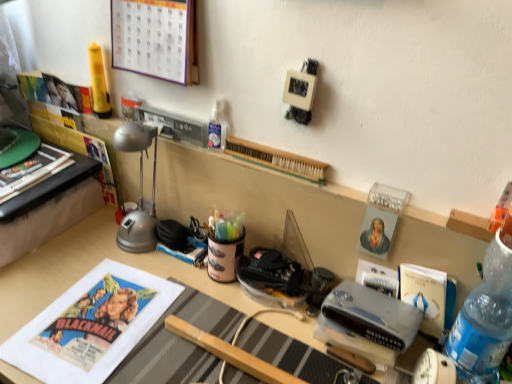
Question: Can you confirm if white paper poster at center is positioned to the left of matte paper calendar at upper left?

Choices:
 (A) no
 (B) yes

Answer: (B)

Question: Is white paper poster at center positioned behind matte paper calendar at upper left?

Choices:
 (A) yes
 (B) no

Answer: (B)

Question: Can you confirm if white paper poster at center is shorter than matte paper calendar at upper left?

Choices:
 (A) no
 (B) yes

Answer: (B)

Question: Is white paper poster at center looking in the opposite direction of matte paper calendar at upper left?

Choices:
 (A) no
 (B) yes

Answer: (A)

Question: Can you confirm if white paper poster at center is wider than matte paper calendar at upper left?

Choices:
 (A) no
 (B) yes

Answer: (B)

Question: From the image's perspective, would you say white paper poster at center is shown under matte paper calendar at upper left?

Choices:
 (A) yes
 (B) no

Answer: (A)

Question: Considering the relative positions of hardcover book at center, positioned as the second paperback book in right-to-left order, and wooden desk at center in the image provided, is hardcover book at center, positioned as the second paperback book in right-to-left order, in front of wooden desk at center?

Choices:
 (A) yes
 (B) no

Answer: (B)

Question: Does hardcover book at center, positioned as the second paperback book in right-to-left order, have a greater height compared to wooden desk at center?

Choices:
 (A) yes
 (B) no

Answer: (B)

Question: Considering the relative sizes of hardcover book at center, positioned as the second paperback book in right-to-left order, and wooden desk at center in the image provided, is hardcover book at center, positioned as the second paperback book in right-to-left order, thinner than wooden desk at center?

Choices:
 (A) no
 (B) yes

Answer: (B)

Question: Does hardcover book at center, placed as the first paperback book when sorted from left to right, lie behind wooden desk at center?

Choices:
 (A) no
 (B) yes

Answer: (B)

Question: From the image's perspective, would you say hardcover book at center, placed as the first paperback book when sorted from left to right, is positioned over wooden desk at center?

Choices:
 (A) no
 (B) yes

Answer: (B)

Question: Is wooden desk at center surrounded by hardcover book at center, positioned as the second paperback book in right-to-left order?

Choices:
 (A) yes
 (B) no

Answer: (B)

Question: Is wooden toothbrush at center positioned with its back to matte paper calendar at upper left?

Choices:
 (A) yes
 (B) no

Answer: (B)